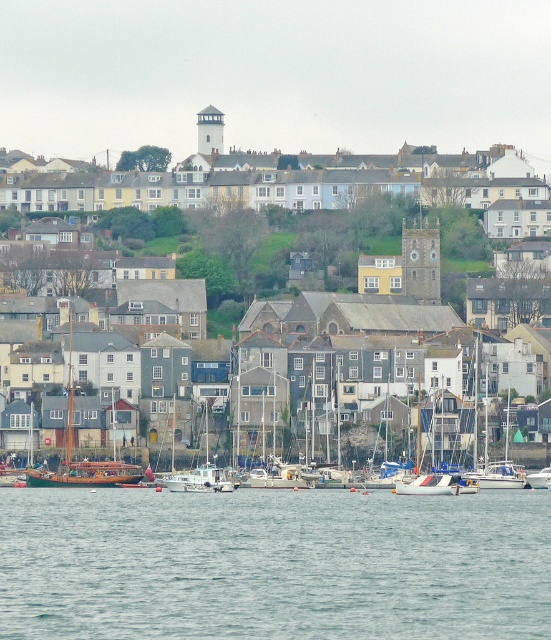
You are standing at the edge of the water in the coastal town scene. There are two points marked on the image, point A at coordinates point (504, 628) and point B at coordinates point (240, 156). Which point is closer to your current position?

Point A at coordinates point (504, 628) is closer to your current position because it is in front of point B at coordinates point (240, 156).